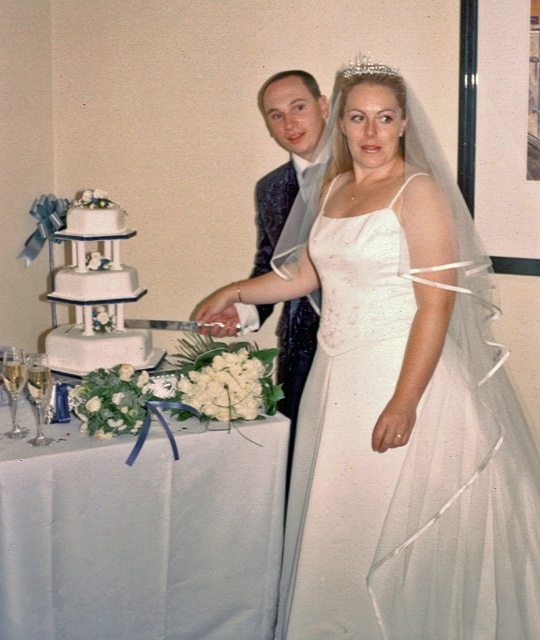
Question: Which of the following is the closest to the observer?

Choices:
 (A) white satin tablecloth at center
 (B) white fondant cake at left

Answer: (A)

Question: Which object is farther from the camera taking this photo?

Choices:
 (A) white satin dress at center
 (B) white satin tablecloth at center

Answer: (B)

Question: From the image, what is the correct spatial relationship of white satin dress at center in relation to white fondant cake at left?

Choices:
 (A) left
 (B) right

Answer: (B)

Question: Does white satin dress at center have a larger size compared to white fondant cake at left?

Choices:
 (A) yes
 (B) no

Answer: (A)

Question: Which point appears farthest from the camera in this image?

Choices:
 (A) (511, 456)
 (B) (230, 612)
 (C) (70, 266)

Answer: (C)

Question: Is white satin dress at center thinner than white satin tablecloth at center?

Choices:
 (A) yes
 (B) no

Answer: (A)